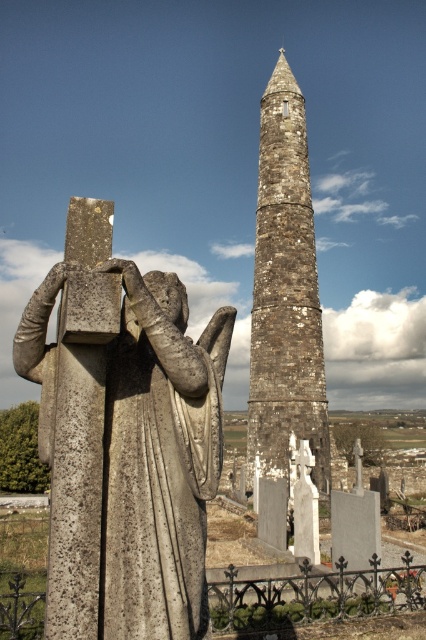
You are an archaeologist examining the cemetery scene. You need to determine which object is narrower between the gray stone statue at center and the rustic stone tower at center. Which one is narrower?

The gray stone statue at center is narrower than the rustic stone tower at center because its width is less than the tower.

Looking at this image, you are a visitor at the cemetery and want to take a photo of both the gray stone statue at center and the rustic stone tower at center. Which object should you focus on first to ensure both are in the frame?

You should focus on the gray stone statue at center first because it is located below the rustic stone tower at center, so positioning the camera to include the lower statue will naturally include the tower above it in the frame.